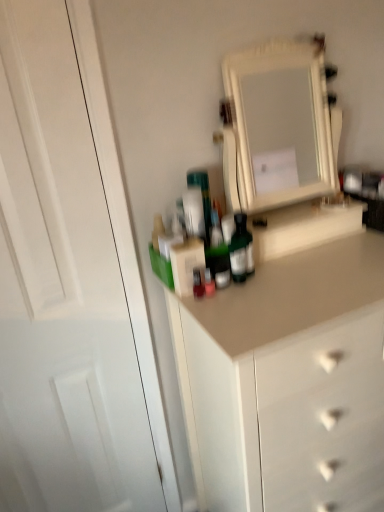
Question: Considering the relative sizes of white glossy door at left and white glossy medicine cabinet at upper center in the image provided, is white glossy door at left taller than white glossy medicine cabinet at upper center?

Choices:
 (A) no
 (B) yes

Answer: (B)

Question: Is white glossy door at left not close to white glossy medicine cabinet at upper center?

Choices:
 (A) yes
 (B) no

Answer: (A)

Question: Does white glossy door at left have a larger size compared to white glossy medicine cabinet at upper center?

Choices:
 (A) yes
 (B) no

Answer: (A)

Question: From the image's perspective, does white glossy door at left appear higher than white glossy medicine cabinet at upper center?

Choices:
 (A) yes
 (B) no

Answer: (B)

Question: Could you tell me if white glossy door at left is turned towards white glossy medicine cabinet at upper center?

Choices:
 (A) no
 (B) yes

Answer: (A)

Question: Can you confirm if white glossy door at left is positioned to the left of white glossy medicine cabinet at upper center?

Choices:
 (A) no
 (B) yes

Answer: (B)

Question: Can you confirm if white glossy medicine cabinet at upper center is positioned to the left of white glossy door at left?

Choices:
 (A) no
 (B) yes

Answer: (A)

Question: Is white glossy medicine cabinet at upper center thinner than white glossy door at left?

Choices:
 (A) yes
 (B) no

Answer: (B)

Question: Is white glossy medicine cabinet at upper center with white glossy door at left?

Choices:
 (A) yes
 (B) no

Answer: (B)

Question: Can you confirm if white glossy medicine cabinet at upper center is shorter than white glossy door at left?

Choices:
 (A) yes
 (B) no

Answer: (A)

Question: From a real-world perspective, does white glossy medicine cabinet at upper center stand above white glossy door at left?

Choices:
 (A) no
 (B) yes

Answer: (B)

Question: Does white glossy medicine cabinet at upper center have a greater height compared to white glossy door at left?

Choices:
 (A) yes
 (B) no

Answer: (B)

Question: Looking at the image, does white glossy medicine cabinet at upper center seem bigger or smaller compared to white glossy door at left?

Choices:
 (A) small
 (B) big

Answer: (A)